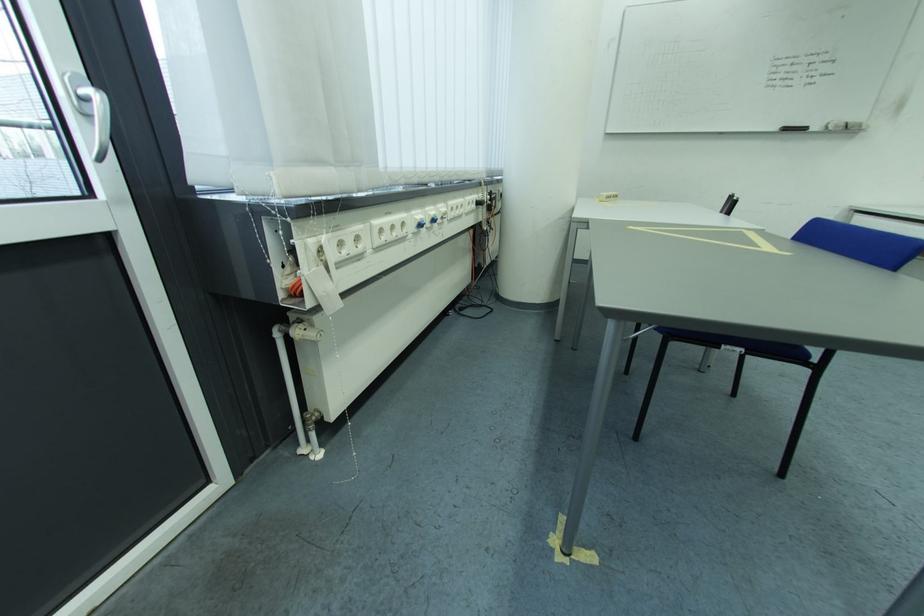
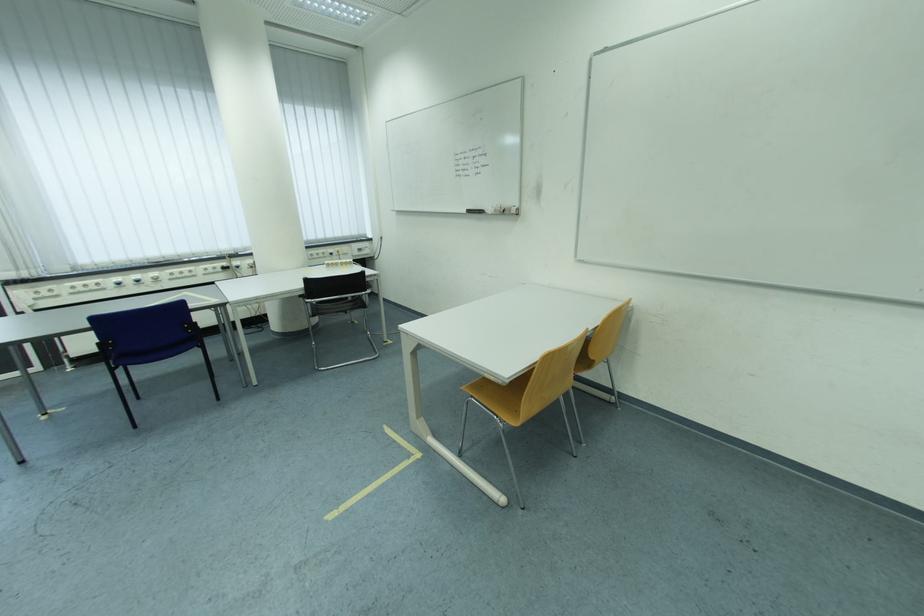
In the second image, find the point that corresponds to [795,129] in the first image.

(476, 213)